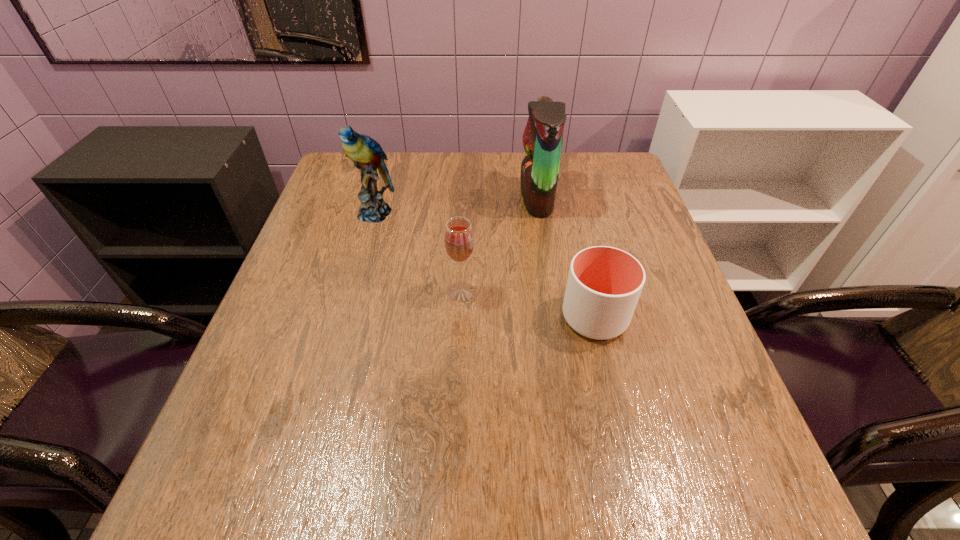
The width and height of the screenshot is (960, 540). In order to click on the right parrot in this screenshot , I will do `click(543, 136)`.

The image size is (960, 540). In order to click on the leftmost object in this screenshot , I will do `click(367, 155)`.

The height and width of the screenshot is (540, 960). In order to click on the second object from left to right in this screenshot , I will do `click(459, 241)`.

This screenshot has height=540, width=960. What are the coordinates of `wineglass` in the screenshot? It's located at (459, 241).

Where is `the shortest object`? The image size is (960, 540). the shortest object is located at coordinates (604, 284).

Find the location of a particular element. The width and height of the screenshot is (960, 540). vacant point located at the face of the right parrot is located at coordinates (375, 198).

You are a GUI agent. You are given a task and a screenshot of the screen. Output one action in this format:
    pyautogui.click(x=<x>, y=<y>)
    Task: Click on the vacant space situated 0.370m at the face of the right parrot
    The image size is (960, 540).
    Given the screenshot: What is the action you would take?
    pyautogui.click(x=386, y=198)

Locate an element on the screen. The width and height of the screenshot is (960, 540). vacant position located at the face of the right parrot is located at coordinates (433, 198).

Locate an element on the screen. This screenshot has width=960, height=540. free region located on the face of the leftmost object is located at coordinates (352, 294).

Locate an element on the screen. The image size is (960, 540). vacant region located 0.070m on the right of the second shortest object is located at coordinates (510, 292).